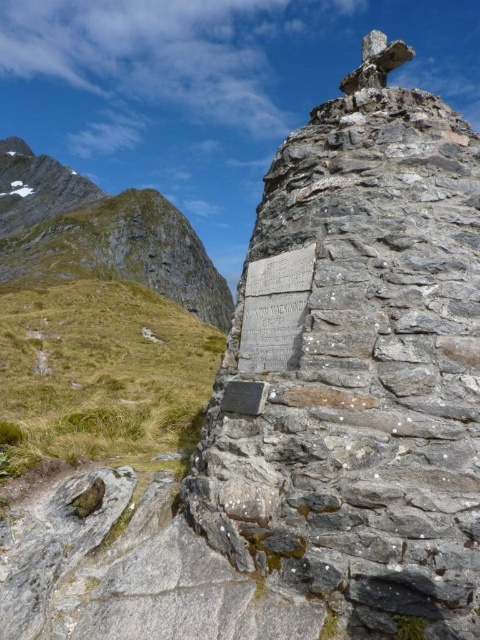
Does gray stone monument at center appear over green grass at left?

Yes.

From the picture: Is gray stone monument at center smaller than green grass at left?

Yes.

Does point (226, 356) come in front of point (165, 310)?

That is True.

Find the location of a particular element. The height and width of the screenshot is (640, 480). gray stone monument at center is located at coordinates (357, 365).

Which is more to the right, gray stone monument at center or rugged stone mountain at upper left?

Positioned to the right is gray stone monument at center.

Where is `gray stone monument at center`? gray stone monument at center is located at coordinates (357, 365).

You are a GUI agent. You are given a task and a screenshot of the screen. Output one action in this format:
    pyautogui.click(x=<x>, y=<y>)
    Task: Click on the gray stone monument at center
    
    Given the screenshot: What is the action you would take?
    pyautogui.click(x=357, y=365)

Who is higher up, gray stone monument at center or white stone plaque at center?

gray stone monument at center is above.

Which is more to the right, gray stone monument at center or white stone plaque at center?

From the viewer's perspective, gray stone monument at center appears more on the right side.

Image resolution: width=480 pixels, height=640 pixels. What do you see at coordinates (357, 365) in the screenshot?
I see `gray stone monument at center` at bounding box center [357, 365].

In order to click on gray stone monument at center in this screenshot , I will do [x=357, y=365].